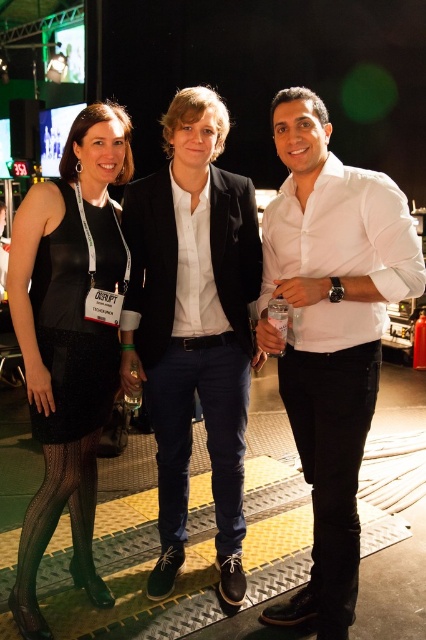
Which is in front, point (327, 550) or point (236, 420)?

Positioned in front is point (327, 550).

Based on the photo, measure the distance between black leather pants at right and camera.

black leather pants at right is 5.93 feet away from camera.

Where is `black leather pants at right`? black leather pants at right is located at coordinates (330, 472).

Between white cotton shirt at center and black leather pants at right, which one is positioned higher?

white cotton shirt at center is above.

You are a GUI agent. You are given a task and a screenshot of the screen. Output one action in this format:
    pyautogui.click(x=<x>, y=<y>)
    Task: Click on the white cotton shirt at center
    This screenshot has height=640, width=426.
    Given the screenshot: What is the action you would take?
    (x=192, y=324)

Is point (146, 284) positioned after point (83, 184)?

Yes, point (146, 284) is behind point (83, 184).

Is white cotton shirt at center thinner than black mesh dress at left?

Incorrect, white cotton shirt at center's width is not less than black mesh dress at left's.

The height and width of the screenshot is (640, 426). Describe the element at coordinates (192, 324) in the screenshot. I see `white cotton shirt at center` at that location.

Where is `white cotton shirt at center`? The width and height of the screenshot is (426, 640). white cotton shirt at center is located at coordinates (192, 324).